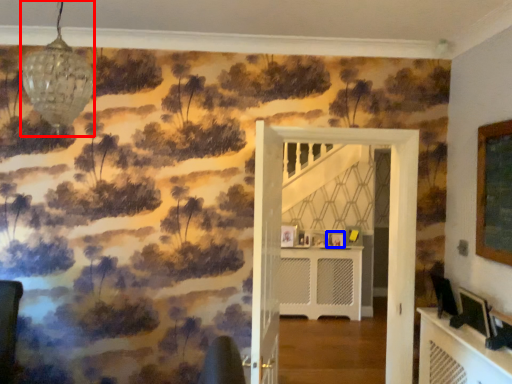
Question: Among these objects, which one is farthest to the camera, light fixture (highlighted by a red box) or picture frame (highlighted by a blue box)?

Choices:
 (A) light fixture
 (B) picture frame

Answer: (B)